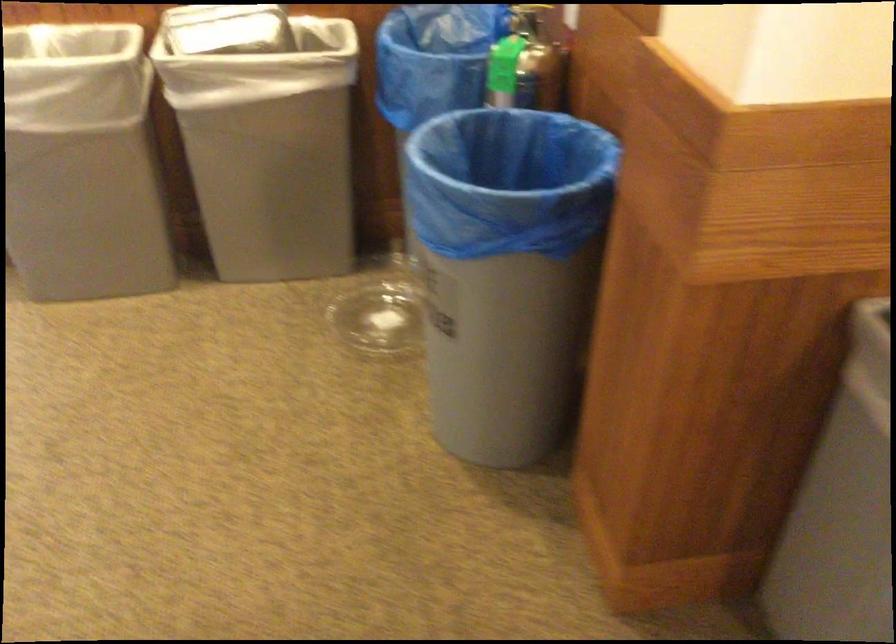
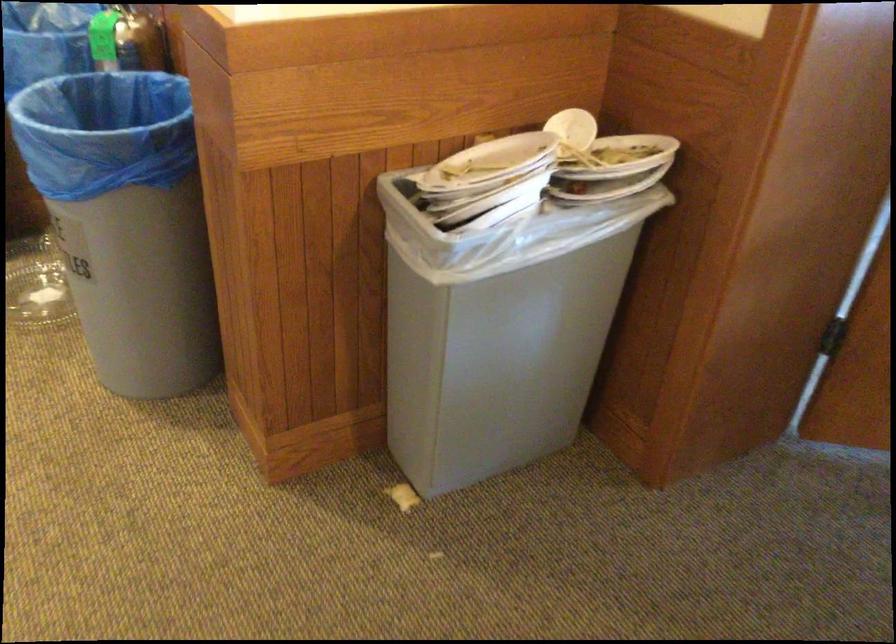
In the second image, find the point that corresponds to point 519,198 in the first image.

(114, 140)